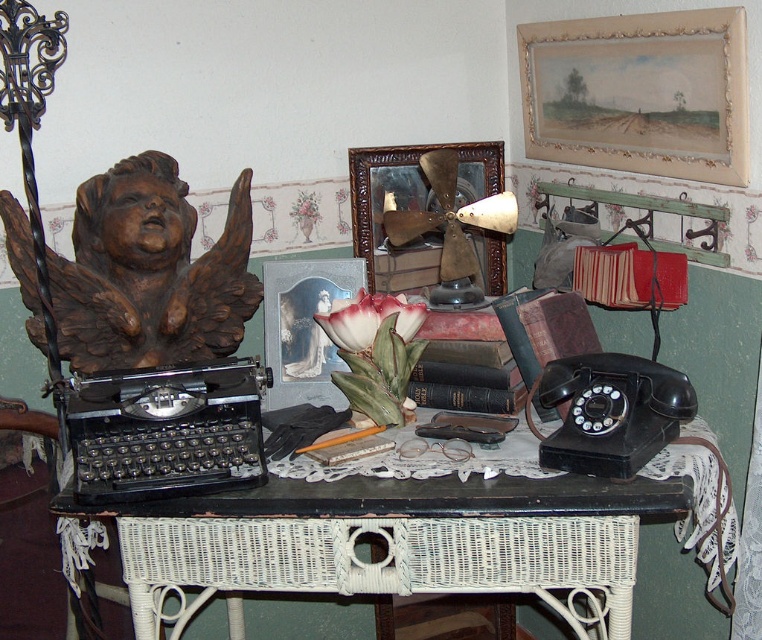
Question: Among these points, which one is nearest to the camera?

Choices:
 (A) (472, 164)
 (B) (296, 353)

Answer: (B)

Question: Which object is farther from the camera taking this photo?

Choices:
 (A) gold-bronze picture frame at center
 (B) metallic silver picture frame at center

Answer: (A)

Question: From the image, what is the correct spatial relationship of gold-bronze picture frame at center in relation to metallic silver picture frame at center?

Choices:
 (A) below
 (B) above

Answer: (B)

Question: Is brown wood cherub at left bigger than watercolor paper painting at upper right?

Choices:
 (A) yes
 (B) no

Answer: (B)

Question: Is brown wood cherub at left thinner than gold-bronze picture frame at center?

Choices:
 (A) yes
 (B) no

Answer: (B)

Question: Estimate the real-world distances between objects in this image. Which object is farther from the metallic silver picture frame at center?

Choices:
 (A) watercolor paper painting at upper right
 (B) black painted wood table at center
 (C) gold-bronze picture frame at center

Answer: (A)